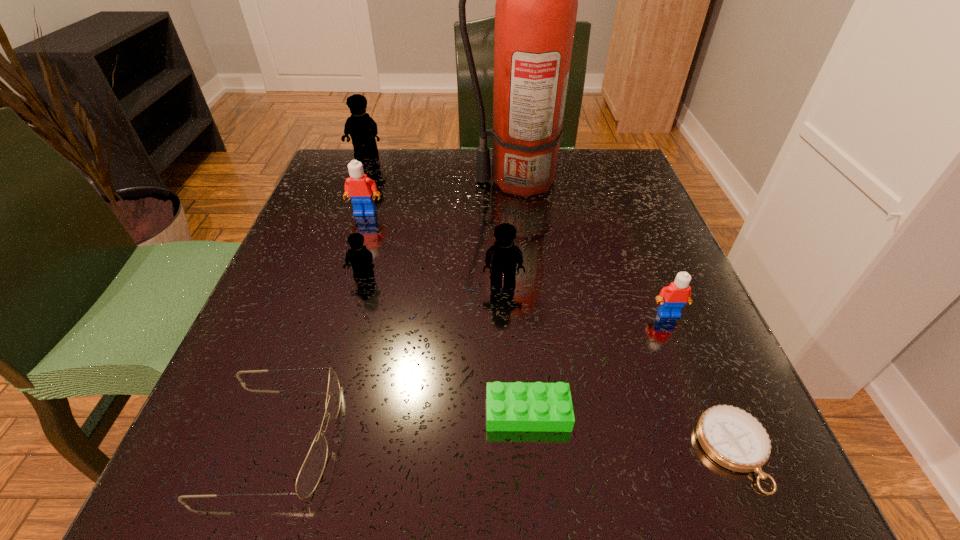
In order to click on vacant space that satisfies the following two spatial constraints: 1. on the front-facing side of the compass; 2. on the right side of the farthest Lego in this screenshot , I will do `click(256, 450)`.

Identify the location of free space that satisfies the following two spatial constraints: 1. on the face of the compass; 2. on the right side of the farther white Lego. This screenshot has height=540, width=960. (290, 450).

Find the location of a particular element. This screenshot has height=540, width=960. free space that satisfies the following two spatial constraints: 1. on the face of the compass; 2. on the right side of the bigger white Lego is located at coordinates (290, 450).

Find the location of a particular element. vacant region that satisfies the following two spatial constraints: 1. on the nozzle of the fire extinguisher; 2. on the face of the second farthest Lego is located at coordinates (519, 213).

The height and width of the screenshot is (540, 960). In order to click on vacant space that satisfies the following two spatial constraints: 1. on the front-facing side of the seventh tallest object; 2. on the left side of the compass in this screenshot , I will do `click(270, 450)`.